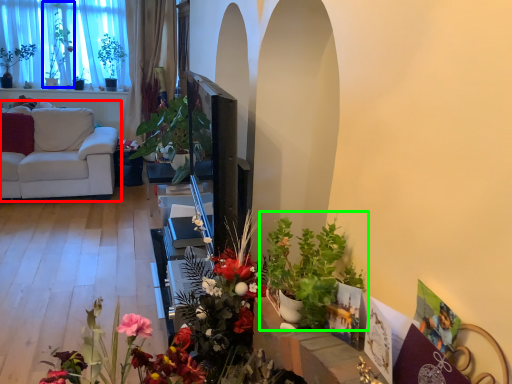
Question: Which object is positioned farthest from studio couch (highlighted by a red box)? Select from bouquet (highlighted by a blue box) and houseplant (highlighted by a green box).

Choices:
 (A) bouquet
 (B) houseplant

Answer: (B)